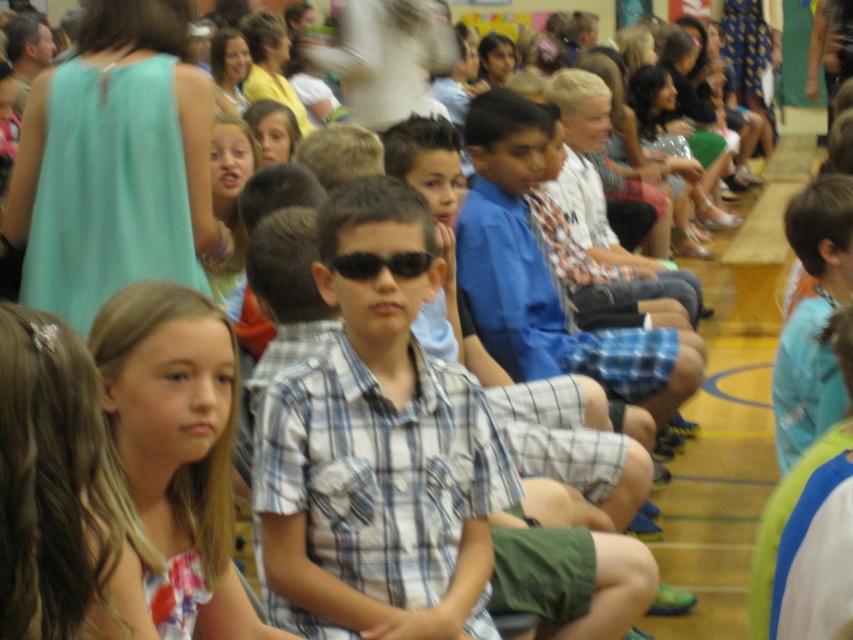
You are a photographer trying to capture a candid shot of the plaid shirt at center and the black plastic sunglasses at center during the event. Since you can only focus on one subject at a time, which one should you choose to ensure the other is still in the background?

The plaid shirt at center is in front of the black plastic sunglasses at center, so you should focus on the plaid shirt at center to have the black plastic sunglasses at center in the background.

You are a photographer trying to capture a candid shot of the blue plaid shirt at center and the black plastic sunglasses at center during the event. Since you want both subjects to be clearly visible in the photo, which object should you focus on first to ensure proper focus?

The blue plaid shirt at center has a larger size compared to black plastic sunglasses at center, so you should focus on the blue plaid shirt at center first to ensure proper focus since it occupies more space in the frame.